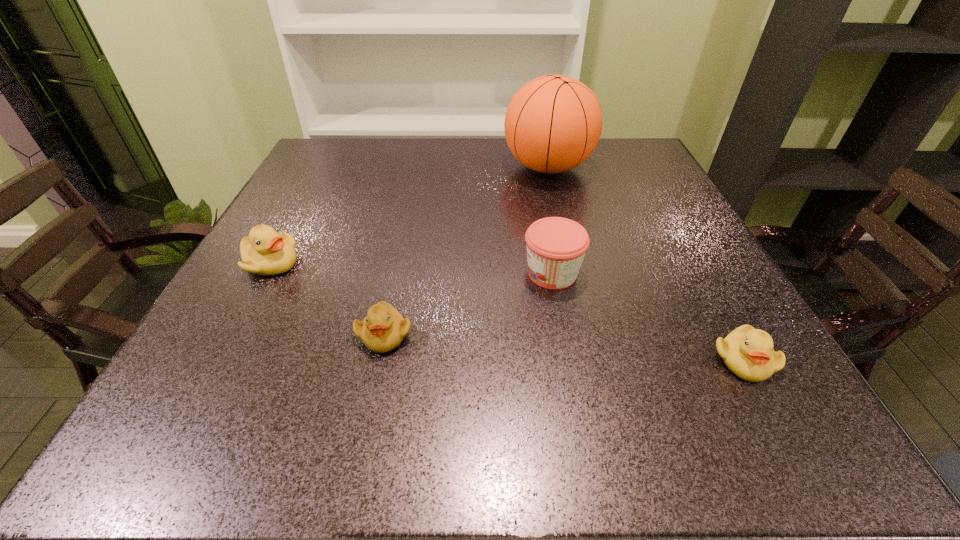
Image resolution: width=960 pixels, height=540 pixels. In order to click on free space at the right edge in this screenshot , I will do tap(697, 366).

The image size is (960, 540). Find the location of `vacant area at the far left corner`. vacant area at the far left corner is located at coordinates (349, 157).

The height and width of the screenshot is (540, 960). Identify the location of free space at the near left corner. (267, 408).

This screenshot has height=540, width=960. I want to click on vacant space at the far right corner of the desktop, so click(613, 144).

Locate an element on the screen. The height and width of the screenshot is (540, 960). vacant space that is in between the farthest duckling and the jam is located at coordinates (411, 268).

The height and width of the screenshot is (540, 960). I want to click on free point between the second duckling from left to right and the rightmost object, so click(564, 347).

At what (x,y) coordinates should I click in order to perform the action: click on free space that is in between the rightmost duckling and the second duckling from right to left. Please return your answer as a coordinate pair (x, y). Looking at the image, I should click on (564, 347).

The height and width of the screenshot is (540, 960). Find the location of `vacant region between the jam and the second duckling from right to left`. vacant region between the jam and the second duckling from right to left is located at coordinates (468, 304).

Find the location of a particular element. The image size is (960, 540). vacant region between the farthest object and the rightmost object is located at coordinates (646, 264).

I want to click on empty location between the rightmost duckling and the basketball, so click(646, 264).